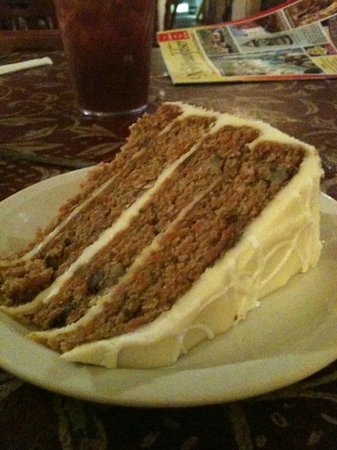
At what (x,y) coordinates should I click in order to perform the action: click on book. Please return your answer as a coordinate pair (x, y). Looking at the image, I should click on (238, 35).